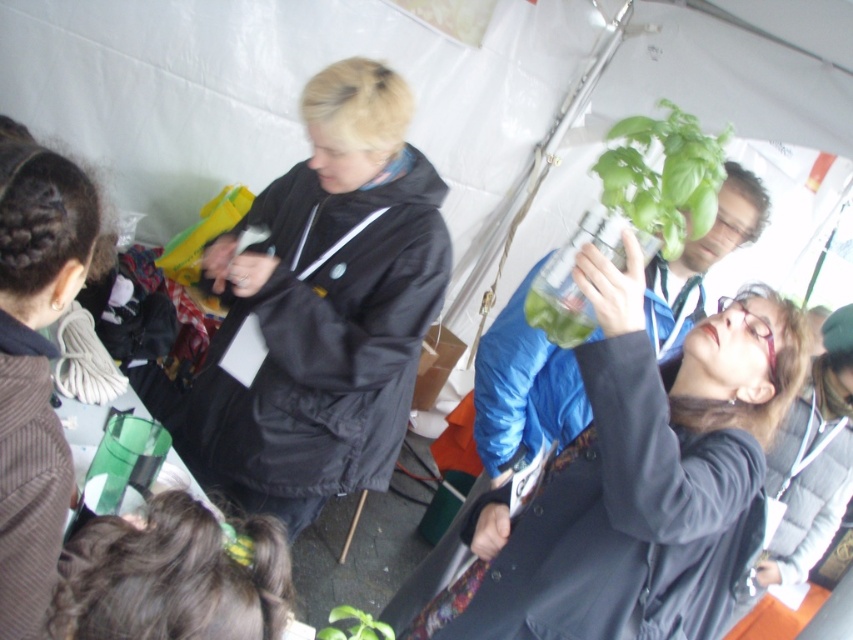
Does matte black coat at center have a greater height compared to dark brown hair at lower left?

Indeed, matte black coat at center has a greater height compared to dark brown hair at lower left.

Does matte black coat at center appear over dark brown hair at lower left?

No.

Describe the element at coordinates (637, 477) in the screenshot. The width and height of the screenshot is (853, 640). I see `matte black coat at center` at that location.

Find the location of a particular element. matte black coat at center is located at coordinates (637, 477).

Is point (229, 492) farther from viewer compared to point (282, 560)?

Yes, it is behind point (282, 560).

Is point (395, 419) in front of point (248, 608)?

No, (395, 419) is further to viewer.

This screenshot has width=853, height=640. What are the coordinates of `black matte jacket at center` in the screenshot? It's located at (323, 308).

Does dark brown textured sweater at lower left have a lesser height compared to dark brown hair at lower left?

No.

Is point (83, 266) behind point (161, 552)?

Yes, it is.

Find the location of a particular element. This screenshot has height=640, width=853. dark brown textured sweater at lower left is located at coordinates (35, 368).